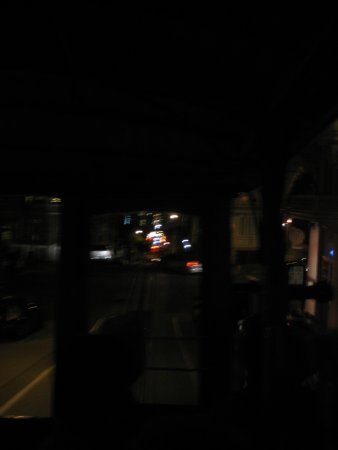
This screenshot has height=450, width=338. In order to click on blue lights in this screenshot , I will do `click(158, 240)`.